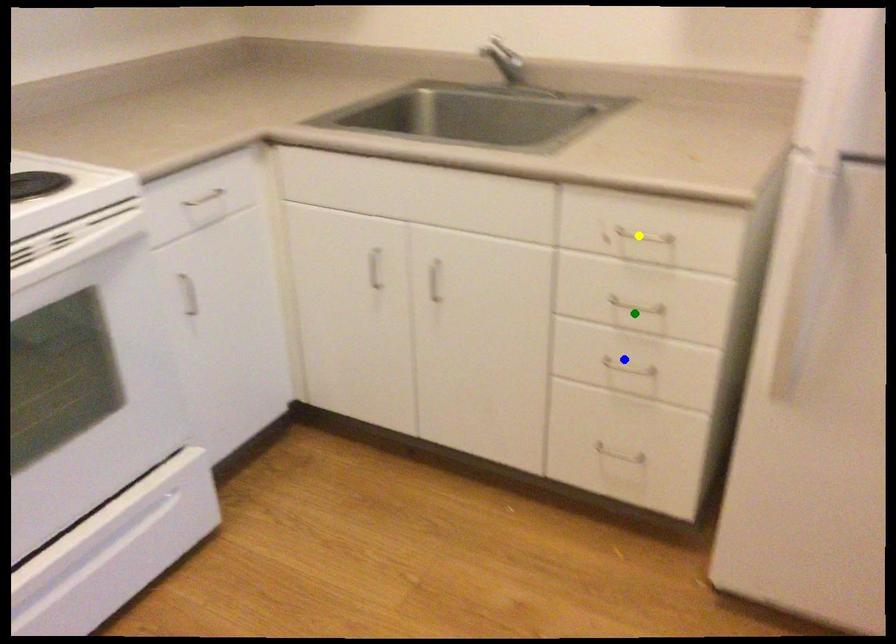
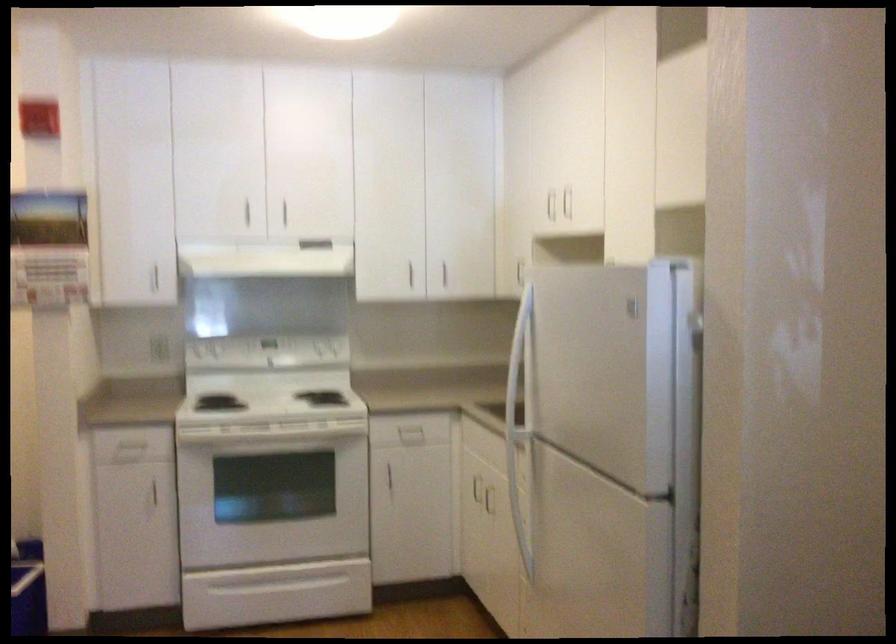
I am providing you with two images of the same scene from different viewpoints. Three points are marked in image1. Which point corresponds to a part or object that is occluded in image2?In image1, three points are marked. Which of them correspond to a part or object that is occluded in image2?Among the three points shown in image1, which one corresponds to a part or object that is no longer visible due to occlusion in image2?

blue point, yellow point, green point